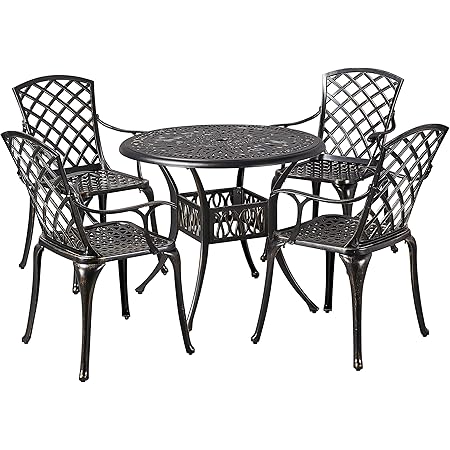
Find the location of a particular element. The width and height of the screenshot is (450, 450). seats of chairs is located at coordinates (333, 167), (327, 230), (107, 241), (93, 181).